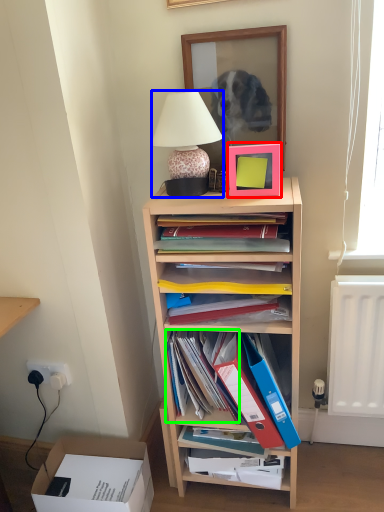
Question: Estimate the real-world distances between objects in this image. Which object is farther from picture frame (highlighted by a red box), lamp (highlighted by a blue box) or book (highlighted by a green box)?

Choices:
 (A) lamp
 (B) book

Answer: (B)